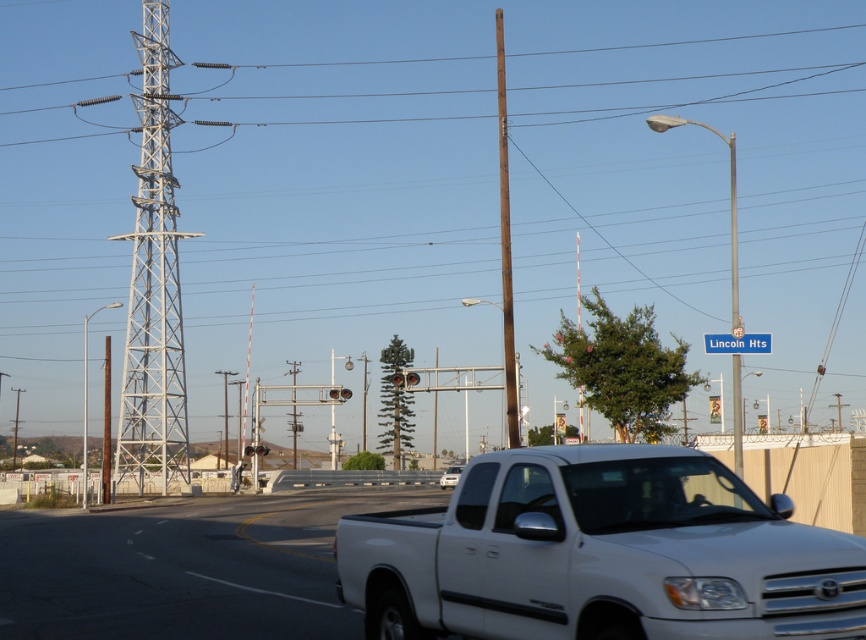
You are driving a car and see the white glossy highway at lower right. Based on its position, can you estimate how far you are from the railroad crossing?

The white glossy highway at lower right is located at point (183, 566), which suggests it is relatively close to the railroad crossing. However, without additional distance markers or scale references in the scene, an exact distance cannot be determined.

You are standing at the railroad crossing where the white pickup truck is stopped. You need to locate the brown wooden pole at center. According to the coordinates provided, where exactly is it positioned relative to the truck?

The brown wooden pole at center is located at coordinates point [505,246] relative to the truck.